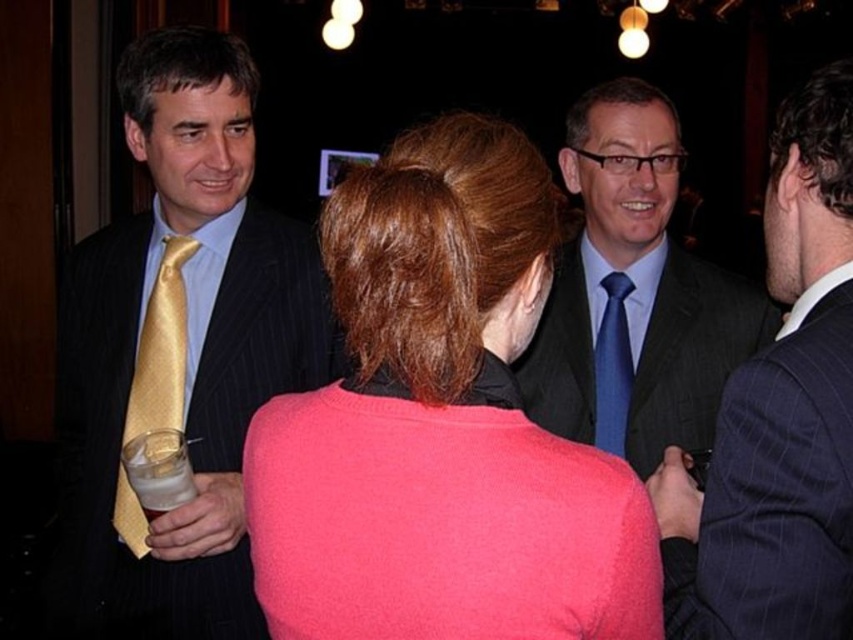
Question: Is blue silk suit at center positioned in front of dark gray pinstripe suit at center?

Choices:
 (A) no
 (B) yes

Answer: (A)

Question: Which of the following is the farthest from the observer?

Choices:
 (A) blue silk tie at center
 (B) matte gold tie at left
 (C) blue silk suit at center

Answer: (A)

Question: Is pink woolen sweater at center smaller than blue silk suit at center?

Choices:
 (A) no
 (B) yes

Answer: (B)

Question: Is matte black suit at right behind blue silk suit at center?

Choices:
 (A) no
 (B) yes

Answer: (A)

Question: Among these objects, which one is nearest to the camera?

Choices:
 (A) matte gold tie at left
 (B) dark gray pinstripe suit at center
 (C) blue silk tie at center

Answer: (A)

Question: Which point is closer to the camera?

Choices:
 (A) (709, 288)
 (B) (738, 602)

Answer: (B)